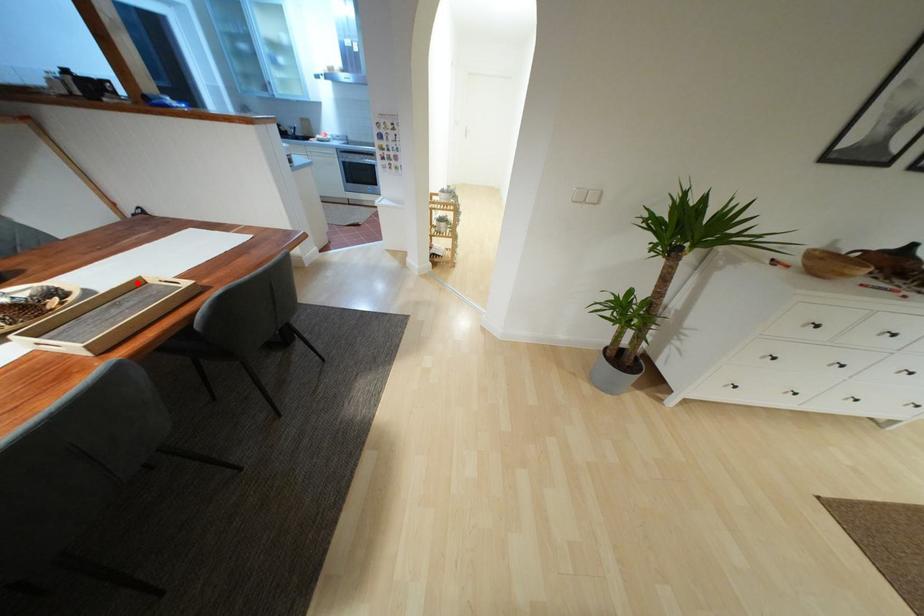
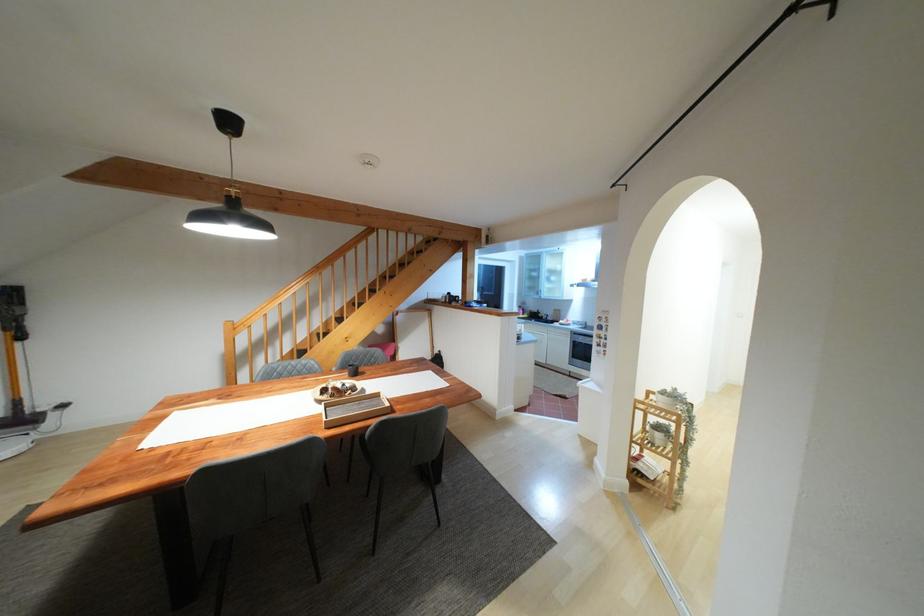
In the second image, find the point that corresponds to the highlighted location in the first image.

(377, 395)